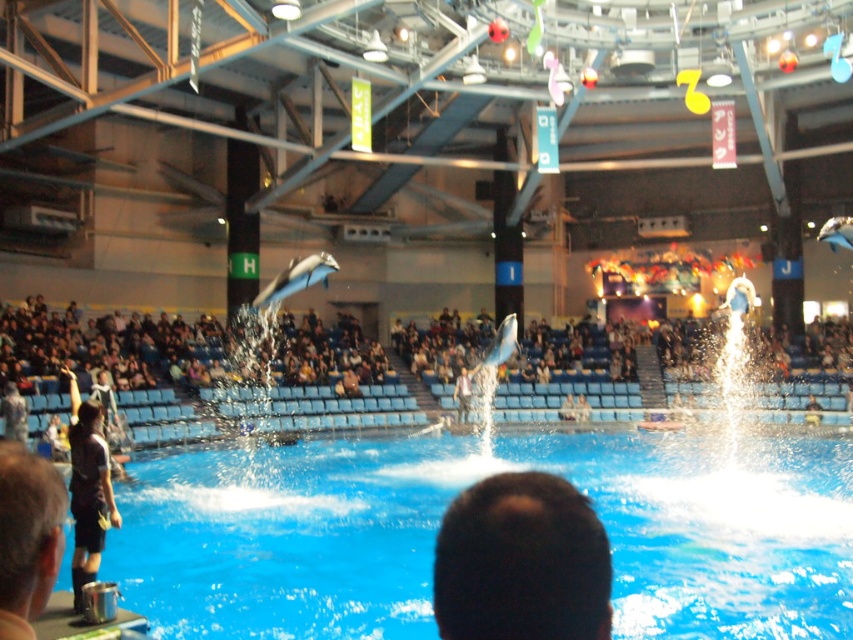
Does blue smooth water at center have a larger size compared to dark hair at center?

Indeed, blue smooth water at center has a larger size compared to dark hair at center.

Is point (793, 540) positioned after point (469, 632)?

Yes, point (793, 540) is behind point (469, 632).

The width and height of the screenshot is (853, 640). Describe the element at coordinates (439, 520) in the screenshot. I see `blue smooth water at center` at that location.

Find the location of a particular element. The width and height of the screenshot is (853, 640). blue smooth water at center is located at coordinates (439, 520).

Is point (825, 465) more distant than point (38, 604)?

Yes, point (825, 465) is farther from viewer.

Is blue smooth water at center further to the viewer compared to dark brown leather jacket at lower left?

No, it is not.

Does point (339, 518) come in front of point (42, 579)?

That is False.

You are a GUI agent. You are given a task and a screenshot of the screen. Output one action in this format:
    pyautogui.click(x=<x>, y=<y>)
    Task: Click on the blue smooth water at center
    
    Given the screenshot: What is the action you would take?
    pyautogui.click(x=439, y=520)

Between dark hair at center and dark brown leather jacket at lower left, which one has less height?

Standing shorter between the two is dark hair at center.

Which is above, dark hair at center or dark brown leather jacket at lower left?

Positioned higher is dark hair at center.

This screenshot has height=640, width=853. What do you see at coordinates (521, 563) in the screenshot?
I see `dark hair at center` at bounding box center [521, 563].

In order to click on dark hair at center in this screenshot , I will do `click(521, 563)`.